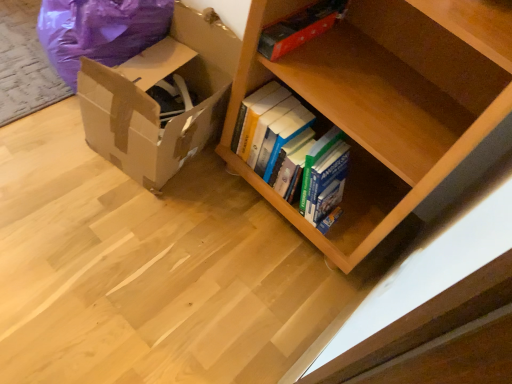
At what (x,y) coordinates should I click in order to perform the action: click on hardcover books at center. Please return your answer as a coordinate pair (x, y). The image size is (512, 384). Looking at the image, I should click on (280, 140).

Image resolution: width=512 pixels, height=384 pixels. Find the location of `hardcover books at center`. hardcover books at center is located at coordinates (280, 140).

Between purple plastic bean bag chair at left and red matte book at upper center, which one appears on the right side from the viewer's perspective?

From the viewer's perspective, red matte book at upper center appears more on the right side.

Can you confirm if purple plastic bean bag chair at left is wider than red matte book at upper center?

Indeed, purple plastic bean bag chair at left has a greater width compared to red matte book at upper center.

Consider the image. Would you consider purple plastic bean bag chair at left to be distant from red matte book at upper center?

That's not correct — purple plastic bean bag chair at left is a little close to red matte book at upper center.

Is red matte book at upper center at the back of purple plastic bean bag chair at left?

No, purple plastic bean bag chair at left is not facing the opposite direction of red matte book at upper center.

Is point (292, 120) positioned after point (137, 154)?

No.

From a real-world perspective, is hardcover books at center positioned over brown cardboard box at lower left based on gravity?

Yes.

Is hardcover books at center turned away from brown cardboard box at lower left?

No, hardcover books at center is not facing the opposite direction of brown cardboard box at lower left.

Considering the sizes of objects hardcover books at center and brown cardboard box at lower left in the image provided, who is smaller, hardcover books at center or brown cardboard box at lower left?

hardcover books at center.

At what (x,y) coordinates should I click in order to perform the action: click on bean bag chair on the left of the hardcover books at center. Please return your answer as a coordinate pair (x, y). Looking at the image, I should click on [x=99, y=31].

Is hardcover books at center smaller than purple plastic bean bag chair at left?

Indeed, hardcover books at center has a smaller size compared to purple plastic bean bag chair at left.

Is purple plastic bean bag chair at left completely or partially inside hardcover books at center?

No, purple plastic bean bag chair at left is not a part of hardcover books at center.

Does point (288, 188) come farther from viewer compared to point (124, 51)?

That is False.

Is brown cardboard box at lower left surrounding red matte book at upper center?

No, red matte book at upper center is not inside brown cardboard box at lower left.

Considering the sizes of objects brown cardboard box at lower left and red matte book at upper center in the image provided, who is taller, brown cardboard box at lower left or red matte book at upper center?

brown cardboard box at lower left is taller.

Can you confirm if brown cardboard box at lower left is positioned to the right of red matte book at upper center?

Incorrect, brown cardboard box at lower left is not on the right side of red matte book at upper center.

From the image's perspective, is brown cardboard box at lower left above red matte book at upper center?

Incorrect, from the image's perspective, brown cardboard box at lower left is lower than red matte book at upper center.

Would you say hardcover books at center is inside or outside red matte book at upper center?

hardcover books at center is outside red matte book at upper center.

Is hardcover books at center further to the viewer compared to red matte book at upper center?

Yes.

Does hardcover books at center have a greater height compared to red matte book at upper center?

Correct, hardcover books at center is much taller as red matte book at upper center.

From the image's perspective, which one is positioned lower, hardcover books at center or red matte book at upper center?

hardcover books at center appears lower in the image.

This screenshot has width=512, height=384. What are the coordinates of `book below the purple plastic bean bag chair at left (from the image's perspective)` in the screenshot? It's located at (280, 140).

Is purple plastic bean bag chair at left looking in the opposite direction of hardcover books at center?

purple plastic bean bag chair at left is not turned away from hardcover books at center.

Does point (67, 70) appear closer or farther from the camera than point (323, 143)?

Point (67, 70) is positioned farther from the camera compared to point (323, 143).

From the image's perspective, is purple plastic bean bag chair at left positioned above or below hardcover books at center?

purple plastic bean bag chair at left is above hardcover books at center.

Does red matte book at upper center have a lesser width compared to brown cardboard box at lower left?

Correct, the width of red matte book at upper center is less than that of brown cardboard box at lower left.

Is red matte book at upper center oriented towards brown cardboard box at lower left?

No, red matte book at upper center is not turned towards brown cardboard box at lower left.

Between red matte book at upper center and brown cardboard box at lower left, which one has more height?

Standing taller between the two is brown cardboard box at lower left.

Could brown cardboard box at lower left be considered to be inside red matte book at upper center?

No, red matte book at upper center does not contain brown cardboard box at lower left.

Locate an element on the screen. paperback book lying below the purple plastic bean bag chair at left (from the image's perspective) is located at coordinates (298, 28).

Image resolution: width=512 pixels, height=384 pixels. In order to click on book located above the brown cardboard box at lower left (from a real-world perspective) in this screenshot , I will do `click(280, 140)`.

Considering their positions, is hardcover books at center positioned further to purple plastic bean bag chair at left than red matte book at upper center?

red matte book at upper center lies further to purple plastic bean bag chair at left than the other object.

Which object lies nearer to the anchor point brown cardboard box at lower left, red matte book at upper center or purple plastic bean bag chair at left?

purple plastic bean bag chair at left is closer to brown cardboard box at lower left.

Which object lies nearer to the anchor point red matte book at upper center, hardcover books at center or purple plastic bean bag chair at left?

hardcover books at center.

Estimate the real-world distances between objects in this image. Which object is further from brown cardboard box at lower left, purple plastic bean bag chair at left or red matte book at upper center?

Based on the image, red matte book at upper center appears to be further to brown cardboard box at lower left.

Considering their positions, is brown cardboard box at lower left positioned further to purple plastic bean bag chair at left than red matte book at upper center?

Result: Based on the image, red matte book at upper center appears to be further to purple plastic bean bag chair at left.

From the image, which object appears to be farther from purple plastic bean bag chair at left, brown cardboard box at lower left or hardcover books at center?

hardcover books at center lies further to purple plastic bean bag chair at left than the other object.

Looking at this image, based on their spatial positions, is brown cardboard box at lower left or purple plastic bean bag chair at left further from hardcover books at center?

Based on the image, purple plastic bean bag chair at left appears to be further to hardcover books at center.

Considering their positions, is purple plastic bean bag chair at left positioned further to red matte book at upper center than hardcover books at center?

Among the two, purple plastic bean bag chair at left is located further to red matte book at upper center.

I want to click on book between brown cardboard box at lower left and red matte book at upper center in the horizontal direction, so click(x=280, y=140).

Identify the location of cardboard box located between purple plastic bean bag chair at left and red matte book at upper center in the left-right direction. The image size is (512, 384). (156, 102).

I want to click on cardboard box between purple plastic bean bag chair at left and hardcover books at center in the horizontal direction, so click(156, 102).

The image size is (512, 384). Find the location of `book situated between purple plastic bean bag chair at left and red matte book at upper center from left to right`. book situated between purple plastic bean bag chair at left and red matte book at upper center from left to right is located at coordinates (280, 140).